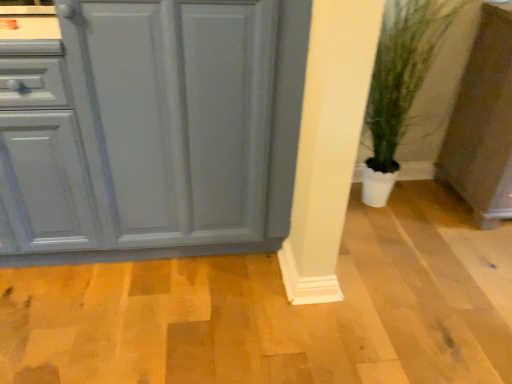
Locate an element on the screen. matte gray cabinet at lower right, which is the 1th cabinetry from right to left is located at coordinates (483, 123).

Where is `matte gray cabinet at left, which is the 2th cabinetry from right to left`? This screenshot has height=384, width=512. matte gray cabinet at left, which is the 2th cabinetry from right to left is located at coordinates (153, 131).

Are matte gray cabinet at lower right, which is the 1th cabinetry from right to left, and matte gray cabinet at left, which is the 2th cabinetry from right to left, located far from each other?

Yes.

From the image's perspective, is matte gray cabinet at lower right, which is the 1th cabinetry from right to left, on matte gray cabinet at left, which is the 2th cabinetry from right to left?

Yes.

From the picture: Can you tell me how much matte gray cabinet at lower right, which is the 1th cabinetry from right to left, and matte gray cabinet at left, which appears as the first cabinetry when viewed from the left, differ in facing direction?

0.627 degrees separate the facing orientations of matte gray cabinet at lower right, which is the 1th cabinetry from right to left, and matte gray cabinet at left, which appears as the first cabinetry when viewed from the left.

Between matte gray cabinet at lower right, which is the 1th cabinetry from right to left, and matte gray cabinet at left, which appears as the first cabinetry when viewed from the left, which one has smaller size?

Smaller between the two is matte gray cabinet at lower right, which is the 1th cabinetry from right to left.

In the scene shown: Considering the relative sizes of green leafy plant in pot at lower right and matte gray cabinet at lower right, which is the second cabinetry from left to right, in the image provided, is green leafy plant in pot at lower right taller than matte gray cabinet at lower right, which is the second cabinetry from left to right,?

Yes.

Is green leafy plant in pot at lower right facing towards matte gray cabinet at lower right, which is the 1th cabinetry from right to left?

No, green leafy plant in pot at lower right is not turned towards matte gray cabinet at lower right, which is the 1th cabinetry from right to left.

From a real-world perspective, which is physically below, green leafy plant in pot at lower right or matte gray cabinet at lower right, which is the 1th cabinetry from right to left?

matte gray cabinet at lower right, which is the 1th cabinetry from right to left.

Does green leafy plant in pot at lower right appear on the right side of matte gray cabinet at lower right, which is the second cabinetry from left to right?

In fact, green leafy plant in pot at lower right is to the left of matte gray cabinet at lower right, which is the second cabinetry from left to right.

Considering the relative sizes of matte gray cabinet at left, which appears as the first cabinetry when viewed from the left, and green leafy plant in pot at lower right in the image provided, is matte gray cabinet at left, which appears as the first cabinetry when viewed from the left, smaller than green leafy plant in pot at lower right?

No, matte gray cabinet at left, which appears as the first cabinetry when viewed from the left, is not smaller than green leafy plant in pot at lower right.

Could you tell me if matte gray cabinet at left, which is the 2th cabinetry from right to left, is turned towards green leafy plant in pot at lower right?

No, matte gray cabinet at left, which is the 2th cabinetry from right to left, does not turn towards green leafy plant in pot at lower right.

Image resolution: width=512 pixels, height=384 pixels. In order to click on houseplant above the matte gray cabinet at lower right, which is the second cabinetry from left to right (from a real-world perspective) in this screenshot , I will do `click(400, 83)`.

From a real-world perspective, is matte gray cabinet at lower right, which is the second cabinetry from left to right, located higher than green leafy plant in pot at lower right?

No, from a real-world perspective, matte gray cabinet at lower right, which is the second cabinetry from left to right, is not on top of green leafy plant in pot at lower right.

Is matte gray cabinet at lower right, which is the 1th cabinetry from right to left, at the left side of green leafy plant in pot at lower right?

No, matte gray cabinet at lower right, which is the 1th cabinetry from right to left, is not to the left of green leafy plant in pot at lower right.

Image resolution: width=512 pixels, height=384 pixels. What are the coordinates of `houseplant below the matte gray cabinet at left, which is the 2th cabinetry from right to left (from a real-world perspective)` in the screenshot? It's located at (400, 83).

From the picture: Is there a large distance between green leafy plant in pot at lower right and matte gray cabinet at left, which appears as the first cabinetry when viewed from the left?

Actually, green leafy plant in pot at lower right and matte gray cabinet at left, which appears as the first cabinetry when viewed from the left, are a little close together.

In the scene shown: Between green leafy plant in pot at lower right and matte gray cabinet at left, which is the 2th cabinetry from right to left, which one is positioned in front?

matte gray cabinet at left, which is the 2th cabinetry from right to left.

Based on the photo, from a real-world perspective, does green leafy plant in pot at lower right stand above matte gray cabinet at left, which is the 2th cabinetry from right to left?

No, from a real-world perspective, green leafy plant in pot at lower right is not above matte gray cabinet at left, which is the 2th cabinetry from right to left.

Who is smaller, matte gray cabinet at left, which appears as the first cabinetry when viewed from the left, or matte gray cabinet at lower right, which is the second cabinetry from left to right?

With smaller size is matte gray cabinet at lower right, which is the second cabinetry from left to right.

Considering the sizes of objects matte gray cabinet at left, which appears as the first cabinetry when viewed from the left, and matte gray cabinet at lower right, which is the second cabinetry from left to right, in the image provided, who is thinner, matte gray cabinet at left, which appears as the first cabinetry when viewed from the left, or matte gray cabinet at lower right, which is the second cabinetry from left to right,?

With smaller width is matte gray cabinet at left, which appears as the first cabinetry when viewed from the left.

There is a matte gray cabinet at lower right, which is the 1th cabinetry from right to left. At what (x,y) coordinates should I click in order to perform the action: click on cabinetry above it (from a real-world perspective). Please return your answer as a coordinate pair (x, y). Looking at the image, I should click on (153, 131).

Which is more to the left, matte gray cabinet at left, which is the 2th cabinetry from right to left, or matte gray cabinet at lower right, which is the second cabinetry from left to right?

From the viewer's perspective, matte gray cabinet at left, which is the 2th cabinetry from right to left, appears more on the left side.

Find the location of a particular element. The width and height of the screenshot is (512, 384). cabinetry on the left of matte gray cabinet at lower right, which is the second cabinetry from left to right is located at coordinates (153, 131).

This screenshot has width=512, height=384. Identify the location of cabinetry on the right of green leafy plant in pot at lower right. (483, 123).

Based on their spatial positions, is green leafy plant in pot at lower right or matte gray cabinet at left, which appears as the first cabinetry when viewed from the left, further from matte gray cabinet at lower right, which is the 1th cabinetry from right to left?

Among the two, matte gray cabinet at left, which appears as the first cabinetry when viewed from the left, is located further to matte gray cabinet at lower right, which is the 1th cabinetry from right to left.

Based on their spatial positions, is matte gray cabinet at lower right, which is the second cabinetry from left to right, or matte gray cabinet at left, which appears as the first cabinetry when viewed from the left, further from green leafy plant in pot at lower right?

matte gray cabinet at left, which appears as the first cabinetry when viewed from the left, is positioned further to the anchor green leafy plant in pot at lower right.

When comparing their distances from matte gray cabinet at left, which is the 2th cabinetry from right to left, does green leafy plant in pot at lower right or matte gray cabinet at lower right, which is the 1th cabinetry from right to left, seem closer?

green leafy plant in pot at lower right is closer to matte gray cabinet at left, which is the 2th cabinetry from right to left.

Looking at the image, which one is located further to matte gray cabinet at lower right, which is the 1th cabinetry from right to left, matte gray cabinet at left, which is the 2th cabinetry from right to left, or green leafy plant in pot at lower right?

Among the two, matte gray cabinet at left, which is the 2th cabinetry from right to left, is located further to matte gray cabinet at lower right, which is the 1th cabinetry from right to left.

Which object lies further to the anchor point green leafy plant in pot at lower right, matte gray cabinet at left, which appears as the first cabinetry when viewed from the left, or matte gray cabinet at lower right, which is the 1th cabinetry from right to left?

Among the two, matte gray cabinet at left, which appears as the first cabinetry when viewed from the left, is located further to green leafy plant in pot at lower right.

When comparing their distances from matte gray cabinet at left, which appears as the first cabinetry when viewed from the left, does matte gray cabinet at lower right, which is the 1th cabinetry from right to left, or green leafy plant in pot at lower right seem further?

Based on the image, matte gray cabinet at lower right, which is the 1th cabinetry from right to left, appears to be further to matte gray cabinet at left, which appears as the first cabinetry when viewed from the left.

Locate an element on the screen. The height and width of the screenshot is (384, 512). houseplant situated between matte gray cabinet at left, which is the 2th cabinetry from right to left, and matte gray cabinet at lower right, which is the 1th cabinetry from right to left, from left to right is located at coordinates (400, 83).